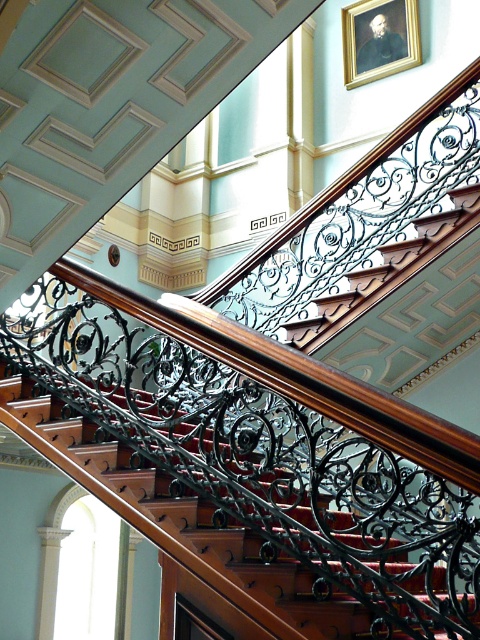
Question: Among these points, which one is nearest to the camera?

Choices:
 (A) (194, 557)
 (B) (396, 16)
 (C) (344, 29)

Answer: (A)

Question: Among these objects, which one is farthest from the camera?

Choices:
 (A) oil painting portrait at upper center
 (B) gold-framed portrait at upper right
 (C) polished wood stairs at center

Answer: (A)

Question: Based on their relative distances, which object is nearer to the oil painting portrait at upper center?

Choices:
 (A) gold-framed portrait at upper right
 (B) polished wood stairs at center

Answer: (A)

Question: Can you confirm if polished wood stairs at center is positioned above gold-framed portrait at upper right?

Choices:
 (A) yes
 (B) no

Answer: (B)

Question: Is gold-framed portrait at upper right behind oil painting portrait at upper center?

Choices:
 (A) yes
 (B) no

Answer: (B)

Question: In this image, where is gold-framed portrait at upper right located relative to oil painting portrait at upper center?

Choices:
 (A) below
 (B) above

Answer: (B)